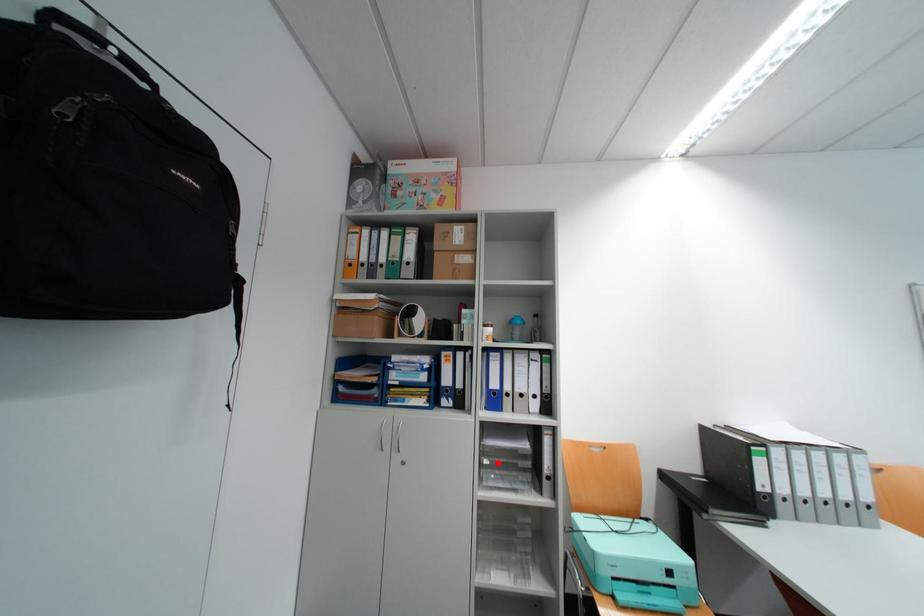
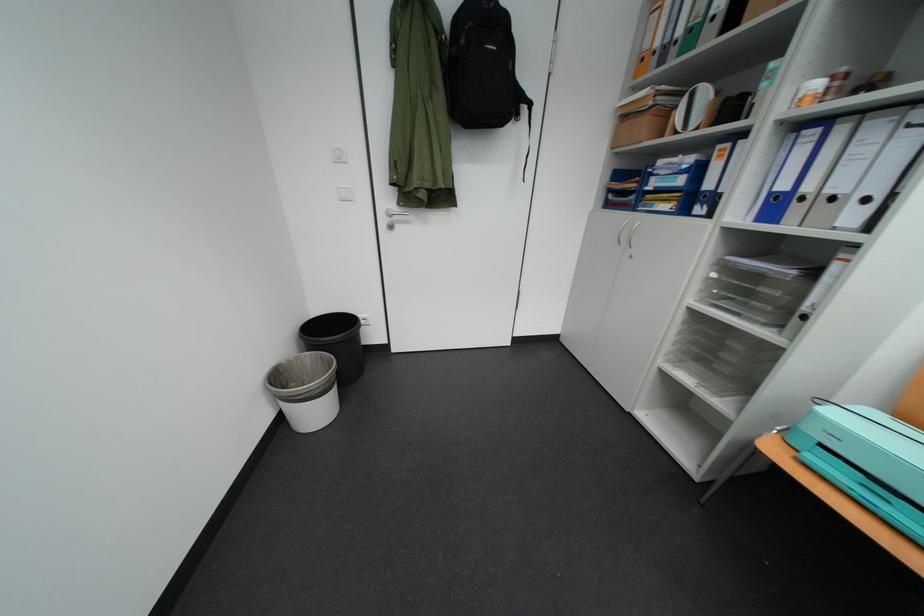
Question: A red point is marked in image1. In image2, is the corresponding 3D point closer to the camera or farther? Reply with the corresponding letter.

Choices:
 (A) The corresponding 3D point is closer.
 (B) The corresponding 3D point is farther.

Answer: (A)